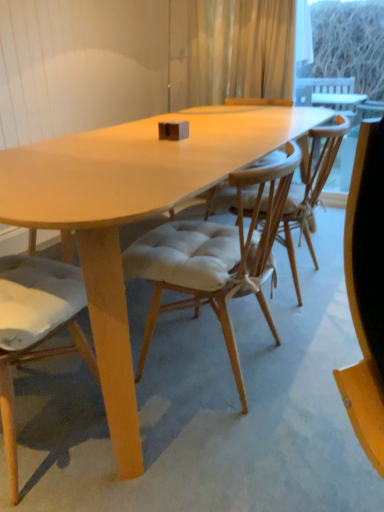
Locate an element on the screen. vacant space underneath light beige fabric chair at center, the 1th chair when ordered from right to left (from a real-world perspective) is located at coordinates (205, 358).